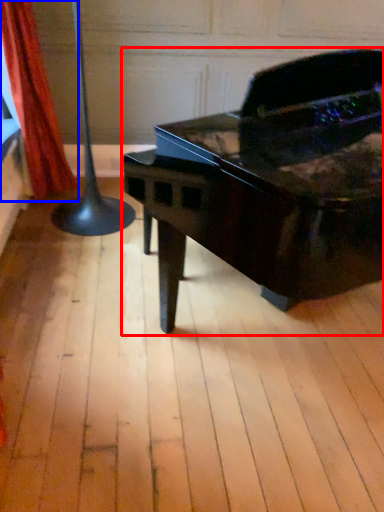
Question: Which of the following is the farthest to the observer, piano (highlighted by a red box) or curtain (highlighted by a blue box)?

Choices:
 (A) piano
 (B) curtain

Answer: (B)